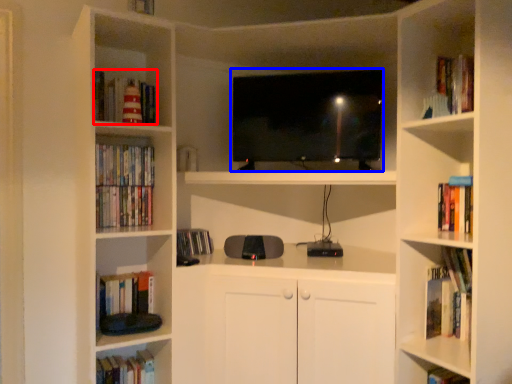
Question: Which of the following is the closest to the observer, book (highlighted by a red box) or television (highlighted by a blue box)?

Choices:
 (A) book
 (B) television

Answer: (A)